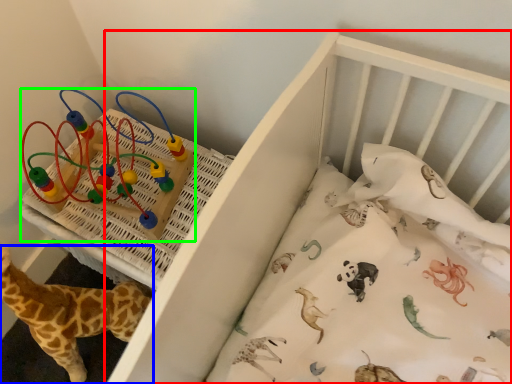
Question: Considering the real-world distances, which object is farthest from infant bed (highlighted by a red box)? giraffe (highlighted by a blue box) or toy (highlighted by a green box)?

Choices:
 (A) giraffe
 (B) toy

Answer: (A)